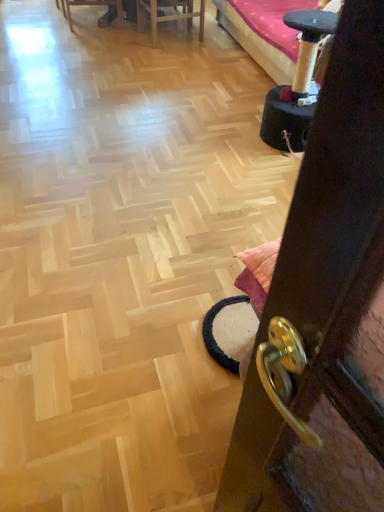
The width and height of the screenshot is (384, 512). What are the coordinates of `unoccupied region to the right of wooden chair at upper center` in the screenshot? It's located at (221, 44).